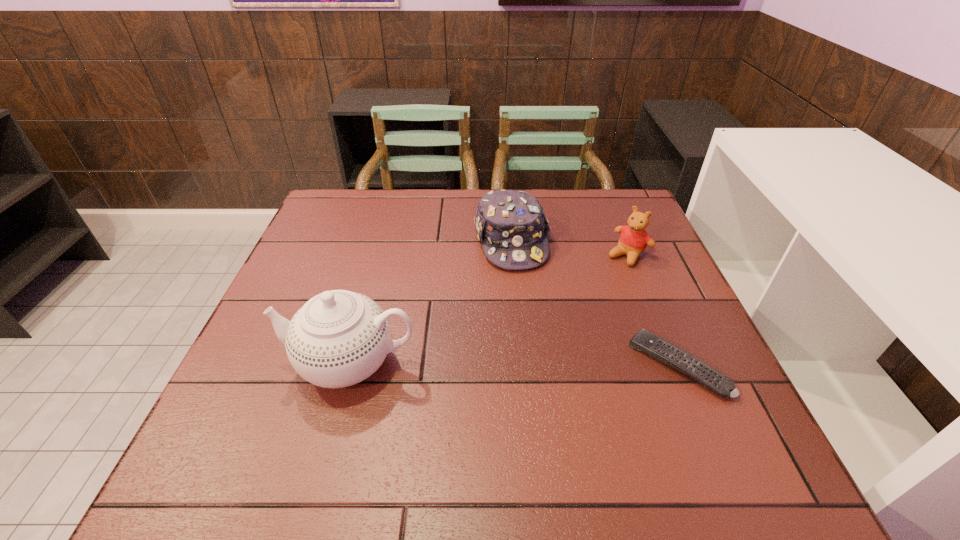
What are the coordinates of `vacant area between the headwear and the shortest object` in the screenshot? It's located at (594, 303).

Identify the location of free spot between the teddy bear and the third object from right to left. (569, 248).

Locate an element on the screen. free point between the headwear and the teddy bear is located at coordinates (569, 248).

Locate an element on the screen. Image resolution: width=960 pixels, height=540 pixels. blank region between the teddy bear and the chinaware is located at coordinates (490, 309).

Image resolution: width=960 pixels, height=540 pixels. Find the location of `free point between the second object from left to right and the teddy bear`. free point between the second object from left to right and the teddy bear is located at coordinates (569, 248).

Identify the location of free point between the third object from right to left and the shortest object. The width and height of the screenshot is (960, 540). (594, 303).

Identify which object is located as the nearest to the teddy bear. Please provide its 2D coordinates. Your answer should be formatted as a tuple, i.e. [(x, y)], where the tuple contains the x and y coordinates of a point satisfying the conditions above.

[(511, 225)]

Locate which object is the second closest to the remote control. Please provide its 2D coordinates. Your answer should be formatted as a tuple, i.e. [(x, y)], where the tuple contains the x and y coordinates of a point satisfying the conditions above.

[(511, 225)]

At what (x,y) coordinates should I click in order to perform the action: click on free space that satisfies the following two spatial constraints: 1. on the front side of the shortest object; 2. on the left side of the teddy bear. Please return your answer as a coordinate pair (x, y). The height and width of the screenshot is (540, 960). Looking at the image, I should click on (673, 365).